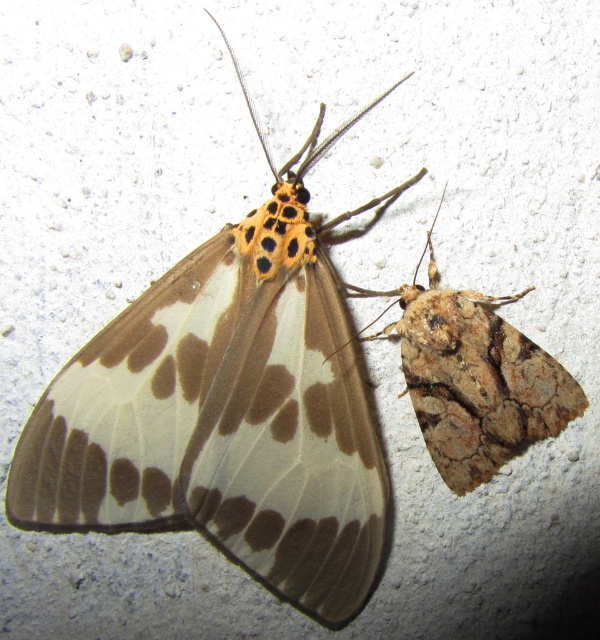
Does translucent brown moth at upper left appear over brown textured moth at right?

Indeed, translucent brown moth at upper left is positioned over brown textured moth at right.

Does translucent brown moth at upper left have a smaller size compared to brown textured moth at right?

No, translucent brown moth at upper left is not smaller than brown textured moth at right.

What do you see at coordinates (229, 408) in the screenshot? I see `translucent brown moth at upper left` at bounding box center [229, 408].

Image resolution: width=600 pixels, height=640 pixels. I want to click on translucent brown moth at upper left, so click(x=229, y=408).